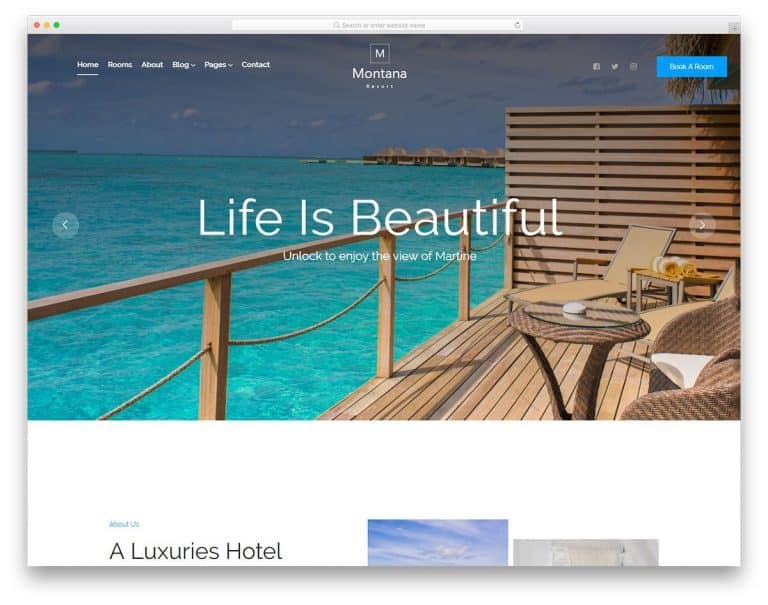
You are a GUI agent. You are given a task and a screenshot of the screen. Output one action in this format:
    pyautogui.click(x=<x>, y=<y>)
    Task: Click on the rooms
    
    Given the screenshot: What is the action you would take?
    pyautogui.click(x=117, y=64)